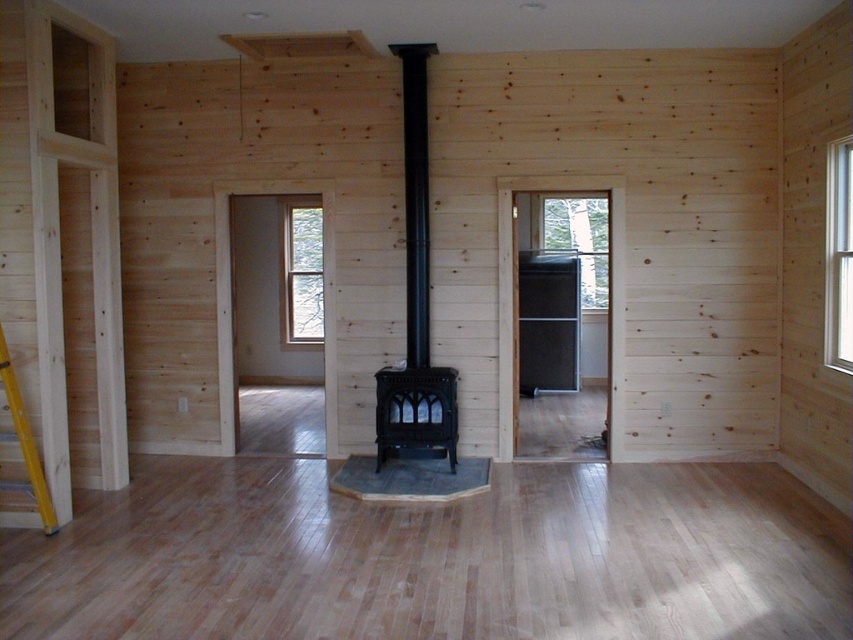
Which is more to the right, black matte fireplace at center or yellow wood ladder at left?

black matte fireplace at center is more to the right.

Does black matte fireplace at center appear under yellow wood ladder at left?

Yes.

Does point (422, 381) lie in front of point (47, 497)?

No, it is not.

Find the location of `black matte fireplace at center`. black matte fireplace at center is located at coordinates (415, 413).

Is black cast iron fireplace at center to the left of black matte fireplace at center from the viewer's perspective?

Correct, you'll find black cast iron fireplace at center to the left of black matte fireplace at center.

Is black cast iron fireplace at center shorter than black matte fireplace at center?

No, black cast iron fireplace at center is not shorter than black matte fireplace at center.

This screenshot has width=853, height=640. Find the location of `black cast iron fireplace at center`. black cast iron fireplace at center is located at coordinates (x=415, y=292).

Identify the location of black cast iron fireplace at center. (415, 292).

In the scene shown: Does black cast iron fireplace at center have a larger size compared to yellow wood ladder at left?

Yes, black cast iron fireplace at center is bigger than yellow wood ladder at left.

This screenshot has width=853, height=640. Identify the location of black cast iron fireplace at center. (415, 292).